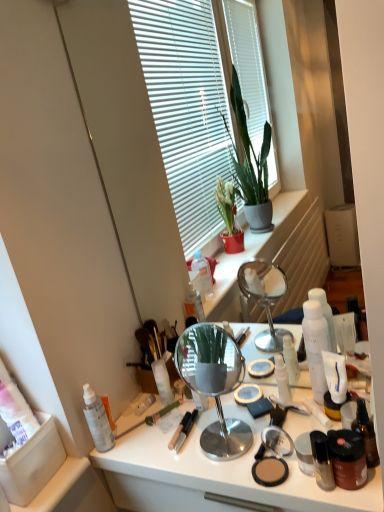
The image size is (384, 512). Identify the location of free area in between polished silver mirror at center and green plastic paint brush at lower left. (168, 432).